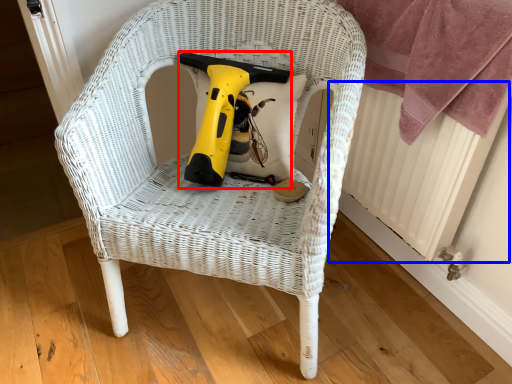
Question: Which point is further to the camera, electric drill (highlighted by a red box) or radiator (highlighted by a blue box)?

Choices:
 (A) electric drill
 (B) radiator

Answer: (A)